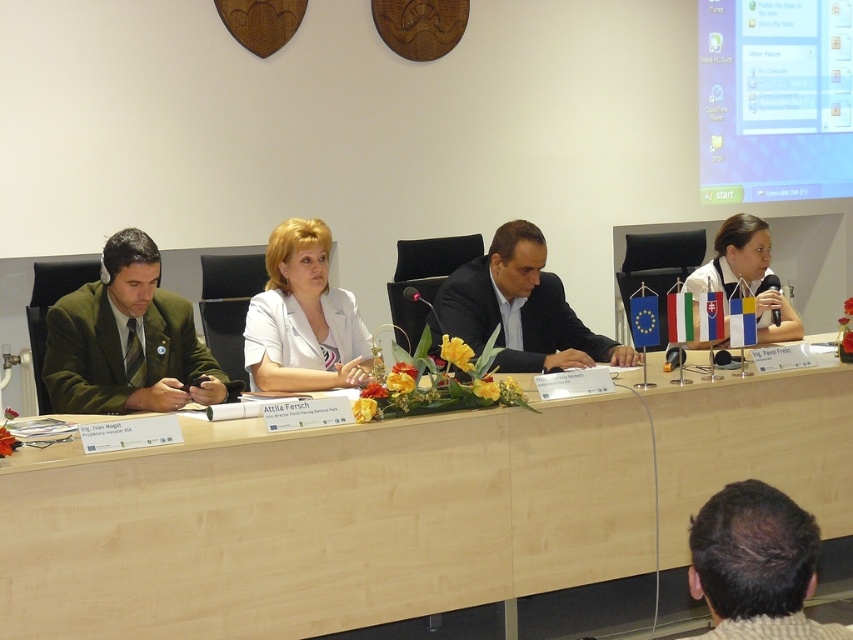
Question: Among these points, which one is nearest to the camera?

Choices:
 (A) (795, 520)
 (B) (514, 268)
 (C) (643, 465)
 (D) (773, 333)

Answer: (A)

Question: Does dark brown hair at lower right lie behind white glossy microphone at upper right?

Choices:
 (A) yes
 (B) no

Answer: (B)

Question: Is light wood table at center smaller than white matte jacket at center?

Choices:
 (A) yes
 (B) no

Answer: (B)

Question: Can you confirm if light wood table at center is smaller than green matte suit at left?

Choices:
 (A) yes
 (B) no

Answer: (B)

Question: Among these objects, which one is farthest from the camera?

Choices:
 (A) dark suit at center
 (B) white glossy microphone at upper right
 (C) green matte suit at left
 (D) white matte jacket at center

Answer: (A)

Question: Estimate the real-world distances between objects in this image. Which object is closer to the white matte jacket at center?

Choices:
 (A) light wood table at center
 (B) dark suit at center
 (C) dark brown hair at lower right

Answer: (B)